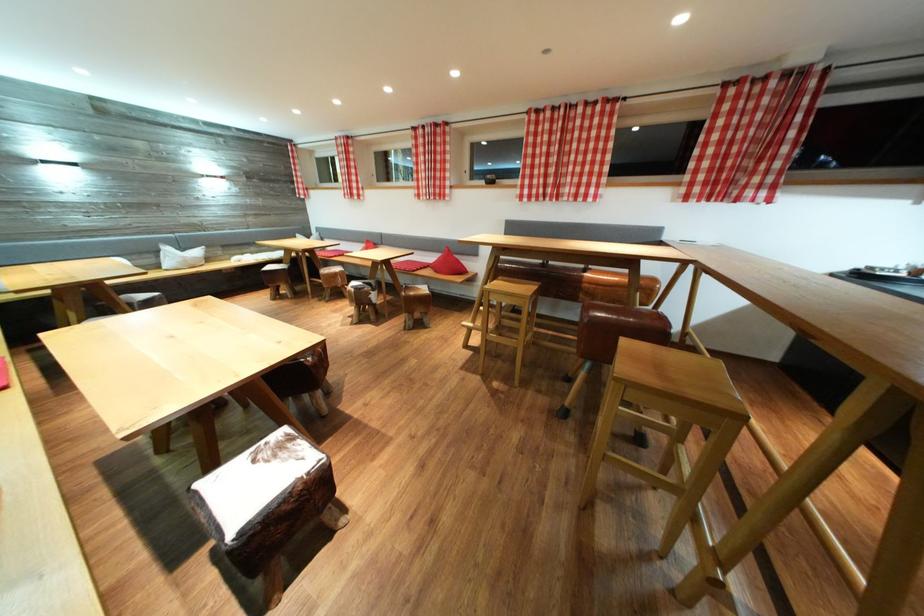
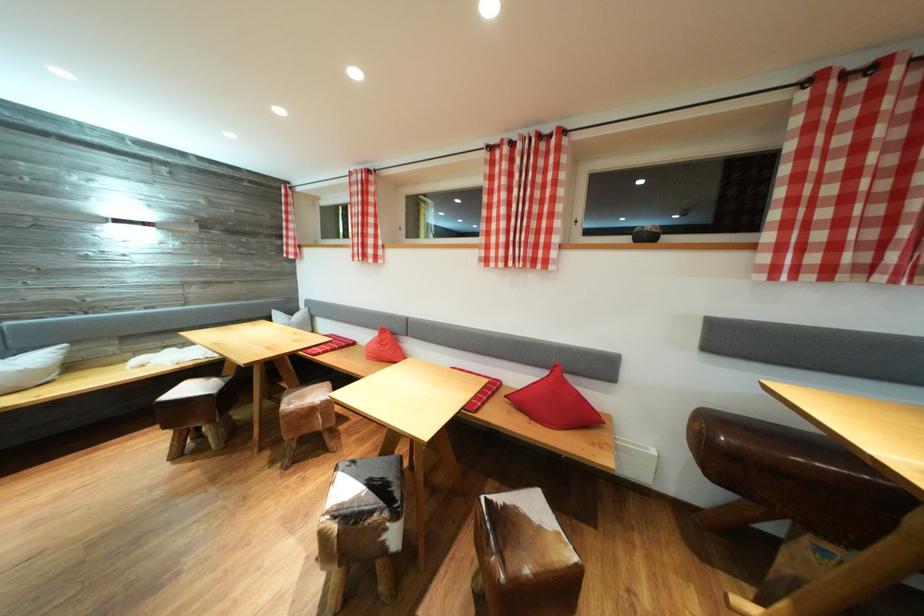
Locate, in the second image, the point that corresponds to (x=374, y=246) in the first image.

(390, 336)